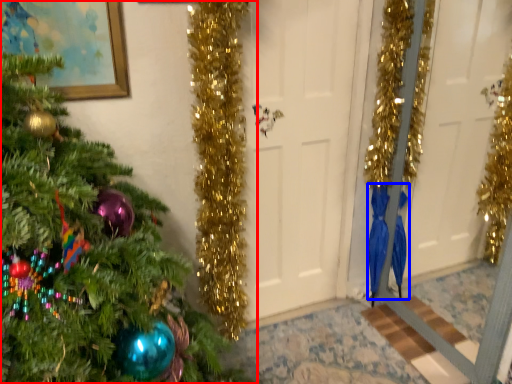
Question: Among these objects, which one is farthest to the camera, christmas tree (highlighted by a red box) or robe (highlighted by a blue box)?

Choices:
 (A) christmas tree
 (B) robe

Answer: (B)